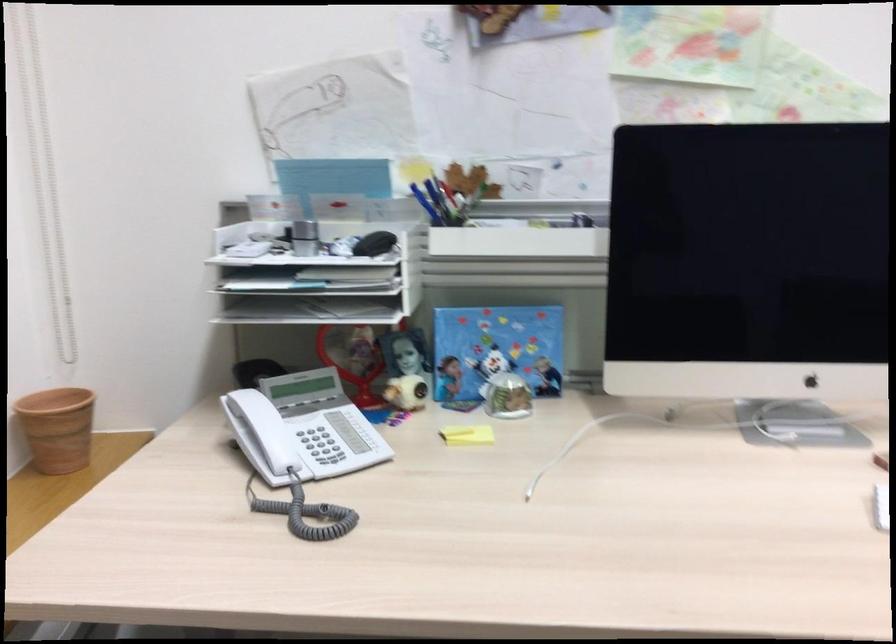
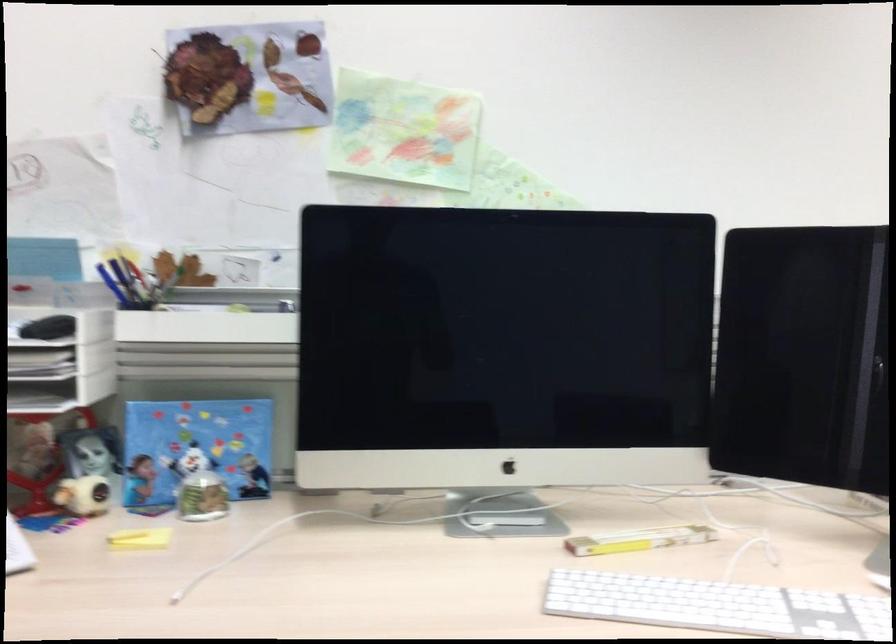
The point at (x=507, y=395) is marked in the first image. Where is the corresponding point in the second image?

(202, 497)